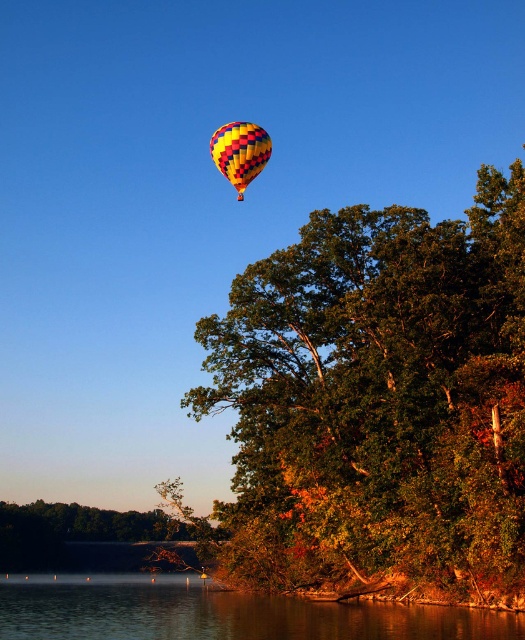
Can you confirm if green leafy tree at lower center is positioned to the left of yellow and red checkered fabric balloon at upper center?

Yes, green leafy tree at lower center is to the left of yellow and red checkered fabric balloon at upper center.

Who is shorter, green leafy tree at lower center or yellow and red checkered fabric balloon at upper center?

Standing shorter between the two is green leafy tree at lower center.

Which is behind, point (16, 566) or point (259, 147)?

Point (16, 566)

Locate an element on the screen. green leafy tree at lower center is located at coordinates (78, 531).

Can you confirm if green leafy tree at upper center is smaller than yellow and red checkered fabric balloon at upper center?

No.

This screenshot has height=640, width=525. What do you see at coordinates (376, 401) in the screenshot?
I see `green leafy tree at upper center` at bounding box center [376, 401].

Is point (237, 352) behind point (236, 154)?

That is True.

At what (x,y) coordinates should I click in order to perform the action: click on green leafy tree at upper center. Please return your answer as a coordinate pair (x, y). Looking at the image, I should click on (376, 401).

Does green leafy tree at upper center have a lesser width compared to smooth water at lower center?

Yes, green leafy tree at upper center is thinner than smooth water at lower center.

Does green leafy tree at upper center have a larger size compared to smooth water at lower center?

Yes.

I want to click on green leafy tree at upper center, so click(x=376, y=401).